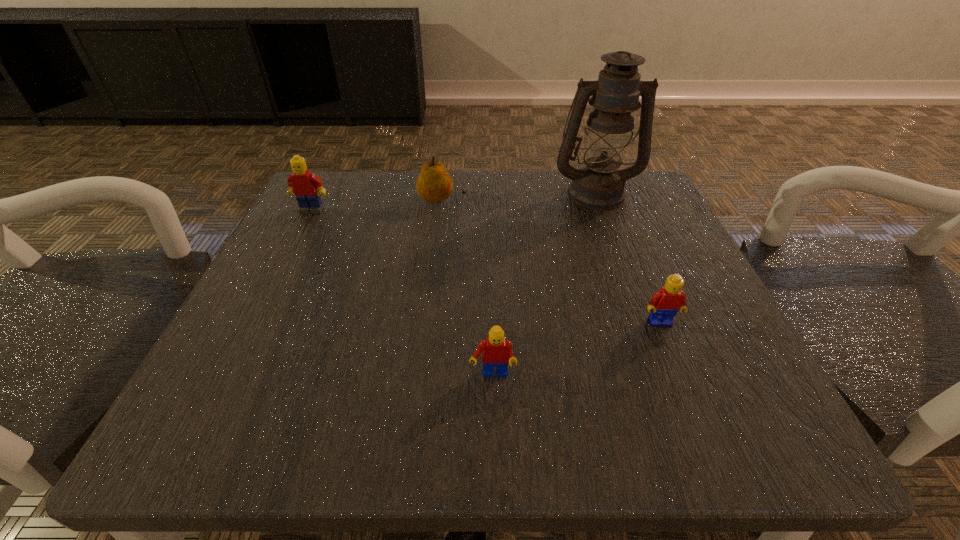
This screenshot has width=960, height=540. In order to click on blank region between the pear and the nearest Lego in this screenshot , I will do `click(468, 288)`.

Locate an element on the screen. free space between the rightmost Lego and the tallest Lego is located at coordinates (486, 266).

You are a GUI agent. You are given a task and a screenshot of the screen. Output one action in this format:
    pyautogui.click(x=<x>, y=<y>)
    Task: Click on the empty space between the rightmost Lego and the farthest Lego
    
    Given the screenshot: What is the action you would take?
    pyautogui.click(x=486, y=266)

Locate an element on the screen. This screenshot has height=540, width=960. empty space between the third object from right to left and the farthest Lego is located at coordinates (402, 293).

Identify the location of free spot between the third object from left to right and the second object from left to right. (468, 288).

Image resolution: width=960 pixels, height=540 pixels. What are the coordinates of `free space between the oil lamp and the fourth object from right to left` in the screenshot? It's located at (519, 196).

Locate an element on the screen. The image size is (960, 540). the second closest object to the second Lego from right to left is located at coordinates (434, 184).

Point out which object is positioned as the third nearest to the leftmost object. Please provide its 2D coordinates. Your answer should be formatted as a tuple, i.e. [(x, y)], where the tuple contains the x and y coordinates of a point satisfying the conditions above.

[(496, 351)]

Locate an element on the screen. Image resolution: width=960 pixels, height=540 pixels. Lego that is the third nearest to the tallest object is located at coordinates (307, 186).

Select which Lego is the second closest to the nearest Lego. Please provide its 2D coordinates. Your answer should be formatted as a tuple, i.e. [(x, y)], where the tuple contains the x and y coordinates of a point satisfying the conditions above.

[(307, 186)]